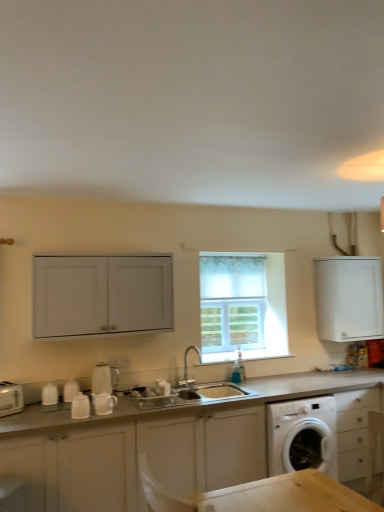
In order to click on white fabric window at center in this screenshot , I will do `click(242, 306)`.

Image resolution: width=384 pixels, height=512 pixels. Describe the element at coordinates (104, 403) in the screenshot. I see `white ceramic mug at lower left, which is counted as the 1th appliance, starting from the right` at that location.

Measure the distance between point (118,333) and camera.

10.29 feet.

What do you see at coordinates (11, 398) in the screenshot? This screenshot has height=512, width=384. I see `white plastic toaster at lower left, marked as the fourth appliance in a right-to-left arrangement` at bounding box center [11, 398].

Locate an element on the screen. white plastic toaster at lower left, the first appliance viewed from the left is located at coordinates (11, 398).

What do you see at coordinates (189, 395) in the screenshot?
I see `satin silver sink at center` at bounding box center [189, 395].

Identify the location of white glossy mugs at lower left, arranged as the 3th appliance when viewed from the right. The width and height of the screenshot is (384, 512). (80, 406).

Image resolution: width=384 pixels, height=512 pixels. Identify the location of white fabric window at center. (242, 306).

Which object is closer to the camera taking this photo, white glossy mugs at lower left, the 2th appliance viewed from the left, or white plastic toaster at lower left, marked as the fourth appliance in a right-to-left arrangement?

white glossy mugs at lower left, the 2th appliance viewed from the left, is more forward.

How far apart are white glossy mugs at lower left, the 2th appliance viewed from the left, and white plastic toaster at lower left, marked as the fourth appliance in a right-to-left arrangement?

white glossy mugs at lower left, the 2th appliance viewed from the left, and white plastic toaster at lower left, marked as the fourth appliance in a right-to-left arrangement, are 16.78 inches apart.

This screenshot has width=384, height=512. There is a white glossy mugs at lower left, the 2th appliance viewed from the left. Identify the location of the 2nd appliance above it (from the image's perspective). (11, 398).

Considering the positions of points (1, 415) and (76, 398), is point (1, 415) closer to camera compared to point (76, 398)?

Yes, point (1, 415) is closer to viewer.

Considering the relative sizes of white plastic toaster at lower left, the first appliance viewed from the left, and white glossy mugs at lower left, arranged as the 3th appliance when viewed from the right, in the image provided, is white plastic toaster at lower left, the first appliance viewed from the left, shorter than white glossy mugs at lower left, arranged as the 3th appliance when viewed from the right,?

Incorrect, the height of white plastic toaster at lower left, the first appliance viewed from the left, does not fall short of that of white glossy mugs at lower left, arranged as the 3th appliance when viewed from the right.

Identify the location of appliance to the left of white glossy mugs at lower left, the 2th appliance viewed from the left. The image size is (384, 512). (11, 398).

Between white glossy kettle at center, acting as the third appliance starting from the left, and white plastic toaster at lower left, the first appliance viewed from the left, which one has larger width?

Wider between the two is white plastic toaster at lower left, the first appliance viewed from the left.

Is white plastic toaster at lower left, marked as the fourth appliance in a right-to-left arrangement, inside white glossy kettle at center, the second appliance when ordered from right to left?

No, white plastic toaster at lower left, marked as the fourth appliance in a right-to-left arrangement, is not inside white glossy kettle at center, the second appliance when ordered from right to left.

Is the surface of white glossy kettle at center, the second appliance when ordered from right to left, in direct contact with white plastic toaster at lower left, the first appliance viewed from the left?

They are not placed beside each other.

From a real-world perspective, between white glossy kettle at center, acting as the third appliance starting from the left, and white plastic toaster at lower left, marked as the fourth appliance in a right-to-left arrangement, who is vertically higher?

white glossy kettle at center, acting as the third appliance starting from the left, is physically above.

Is silver metallic faucet at center aimed at white plastic toaster at lower left, marked as the fourth appliance in a right-to-left arrangement?

No, silver metallic faucet at center is not oriented towards white plastic toaster at lower left, marked as the fourth appliance in a right-to-left arrangement.

Looking at this image, what's the angular difference between silver metallic faucet at center and white plastic toaster at lower left, the first appliance viewed from the left,'s facing directions?

They differ by 29.6 degrees in their facing directions.

From a real-world perspective, which is physically below, silver metallic faucet at center or white plastic toaster at lower left, marked as the fourth appliance in a right-to-left arrangement?

white plastic toaster at lower left, marked as the fourth appliance in a right-to-left arrangement, from a real-world perspective.

Is white plastic toaster at lower left, the first appliance viewed from the left, located within silver metallic faucet at center?

No, white plastic toaster at lower left, the first appliance viewed from the left, is located outside of silver metallic faucet at center.

Which of these two, white matte cabinet at upper left, the 1th cabinetry positioned from the top, or white plastic toaster at lower left, marked as the fourth appliance in a right-to-left arrangement, is thinner?

white plastic toaster at lower left, marked as the fourth appliance in a right-to-left arrangement.

Is white matte cabinet at upper left, the 3th cabinetry viewed from the right, positioned in front of white plastic toaster at lower left, the first appliance viewed from the left?

That is False.

Is white matte cabinet at upper left, the first cabinetry from the left, situated inside white plastic toaster at lower left, the first appliance viewed from the left, or outside?

white matte cabinet at upper left, the first cabinetry from the left, is not inside white plastic toaster at lower left, the first appliance viewed from the left, it's outside.

Considering the positions of objects white matte cabinet at upper left, the first cabinetry from the left, and white plastic toaster at lower left, the first appliance viewed from the left, in the image provided, who is more to the right, white matte cabinet at upper left, the first cabinetry from the left, or white plastic toaster at lower left, the first appliance viewed from the left,?

From the viewer's perspective, white matte cabinet at upper left, the first cabinetry from the left, appears more on the right side.

Where is `appliance that is the 1st object directly below the white matte cabinet at upper left, the 1th cabinetry positioned from the top (from a real-world perspective)`? The image size is (384, 512). appliance that is the 1st object directly below the white matte cabinet at upper left, the 1th cabinetry positioned from the top (from a real-world perspective) is located at coordinates (104, 378).

Measure the distance between white glossy kettle at center, the second appliance when ordered from right to left, and white matte cabinet at upper left, the 3th cabinetry from the bottom.

white glossy kettle at center, the second appliance when ordered from right to left, and white matte cabinet at upper left, the 3th cabinetry from the bottom, are 22.02 inches apart.

From the image's perspective, is white glossy kettle at center, acting as the third appliance starting from the left, on white matte cabinet at upper left, the 3th cabinetry viewed from the right?

Actually, white glossy kettle at center, acting as the third appliance starting from the left, appears below white matte cabinet at upper left, the 3th cabinetry viewed from the right, in the image.

How many degrees apart are the facing directions of white ceramic mug at lower left, which is counted as the 1th appliance, starting from the right, and white plastic toaster at lower left, marked as the fourth appliance in a right-to-left arrangement?

They differ by 31.6 degrees in their facing directions.

Is point (116, 397) positioned before point (20, 400)?

No.

Is white ceramic mug at lower left, arranged as the 4th appliance when viewed from the left, looking in the opposite direction of white plastic toaster at lower left, marked as the fourth appliance in a right-to-left arrangement?

No, white ceramic mug at lower left, arranged as the 4th appliance when viewed from the left, is not facing the opposite direction of white plastic toaster at lower left, marked as the fourth appliance in a right-to-left arrangement.

Which object is positioned more to the right, white ceramic mug at lower left, which is counted as the 1th appliance, starting from the right, or white plastic toaster at lower left, marked as the fourth appliance in a right-to-left arrangement?

white ceramic mug at lower left, which is counted as the 1th appliance, starting from the right, is more to the right.

There is a white plastic toaster at lower left, the first appliance viewed from the left. Identify the location of the 2nd appliance below it (from the image's perspective). (80, 406).

At what (x,y) coordinates should I click in order to perform the action: click on appliance on the left of white glossy mugs at lower left, the 2th appliance viewed from the left. Please return your answer as a coordinate pair (x, y). The width and height of the screenshot is (384, 512). Looking at the image, I should click on [11, 398].

Based on their spatial positions, is white matte cabinet at upper right, acting as the 2th cabinetry starting from the top, or white ceramic mug at lower left, arranged as the 4th appliance when viewed from the left, closer to satin silver sink at center?

Among the two, white ceramic mug at lower left, arranged as the 4th appliance when viewed from the left, is located nearer to satin silver sink at center.

When comparing their distances from white matte cabinet at upper right, which is counted as the 2th cabinetry, starting from the bottom, does white glossy kettle at center, the second appliance when ordered from right to left, or silver metallic faucet at center seem closer?

silver metallic faucet at center.

Estimate the real-world distances between objects in this image. Which object is closer to white fabric window at center, white glossy kettle at center, the second appliance when ordered from right to left, or white matte cabinet at center, the 2th cabinetry from the right?

Based on the image, white matte cabinet at center, the 2th cabinetry from the right, appears to be nearer to white fabric window at center.

Considering their positions, is white glossy mugs at lower left, the 2th appliance viewed from the left, positioned further to white ceramic mug at lower left, arranged as the 4th appliance when viewed from the left, than white fabric window at center?

Among the two, white fabric window at center is located further to white ceramic mug at lower left, arranged as the 4th appliance when viewed from the left.

Which object lies nearer to the anchor point white fabric window at center, white matte cabinet at upper left, the 3th cabinetry viewed from the right, or white glossy mugs at lower left, arranged as the 3th appliance when viewed from the right?

Based on the image, white matte cabinet at upper left, the 3th cabinetry viewed from the right, appears to be nearer to white fabric window at center.

Looking at the image, which one is located further to white matte cabinet at upper right, which is counted as the 2th cabinetry, starting from the bottom, white plastic toaster at lower left, the first appliance viewed from the left, or white matte cabinet at center, the third cabinetry in the top-to-bottom sequence?

Among the two, white plastic toaster at lower left, the first appliance viewed from the left, is located further to white matte cabinet at upper right, which is counted as the 2th cabinetry, starting from the bottom.

Which object lies nearer to the anchor point white fabric window at center, white matte cabinet at center, acting as the 2th cabinetry starting from the left, or silver metallic faucet at center?

silver metallic faucet at center lies closer to white fabric window at center than the other object.

Looking at the image, which one is located further to white plastic toaster at lower left, marked as the fourth appliance in a right-to-left arrangement, satin silver sink at center or white matte cabinet at upper right, which is counted as the 2th cabinetry, starting from the bottom?

Among the two, white matte cabinet at upper right, which is counted as the 2th cabinetry, starting from the bottom, is located further to white plastic toaster at lower left, marked as the fourth appliance in a right-to-left arrangement.

Locate an element on the screen. window between white glossy mugs at lower left, the 2th appliance viewed from the left, and white matte cabinet at upper right, acting as the 2th cabinetry starting from the top, in the horizontal direction is located at coordinates (242, 306).

This screenshot has width=384, height=512. I want to click on sink between white glossy mugs at lower left, the 2th appliance viewed from the left, and white fabric window at center, along the z-axis, so click(x=189, y=395).

Locate an element on the screen. sink between white ceramic mug at lower left, arranged as the 4th appliance when viewed from the left, and white matte cabinet at upper right, which is counted as the 2th cabinetry, starting from the bottom is located at coordinates (189, 395).

The height and width of the screenshot is (512, 384). Identify the location of sink between white matte cabinet at upper left, the 1th cabinetry positioned from the top, and white matte cabinet at center, acting as the 1th cabinetry starting from the bottom, in the vertical direction. (189, 395).